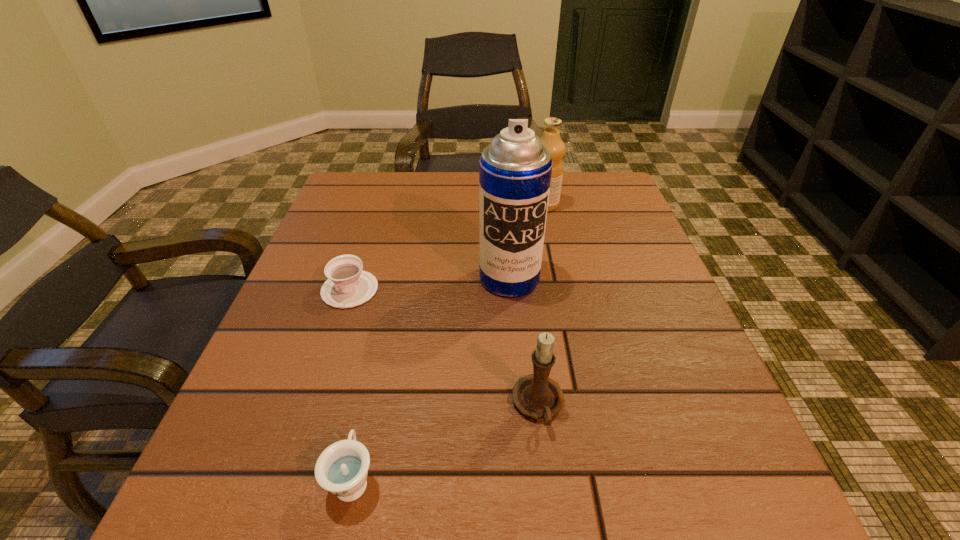
At what (x,y) coordinates should I click in order to perform the action: click on the tallest object. Please return your answer as a coordinate pair (x, y). This screenshot has height=540, width=960. Looking at the image, I should click on (515, 170).

The image size is (960, 540). Identify the location of the second tallest object. (551, 139).

Find the location of `olive oil`. olive oil is located at coordinates (551, 139).

You are a GUI agent. You are given a task and a screenshot of the screen. Output one action in this format:
    pyautogui.click(x=<x>, y=<y>)
    Task: Click on the third tallest object
    
    Given the screenshot: What is the action you would take?
    coord(536,395)

Where is `the second nearest object`? the second nearest object is located at coordinates (536, 395).

At what (x,y) coordinates should I click in order to perform the action: click on the nearest object. Please return your answer as a coordinate pair (x, y). This screenshot has height=540, width=960. Looking at the image, I should click on (342, 468).

At what (x,y) coordinates should I click in order to perform the action: click on the farther teacup. Please return your answer as a coordinate pair (x, y). The height and width of the screenshot is (540, 960). Looking at the image, I should click on (348, 285).

Locate an element on the screen. The width and height of the screenshot is (960, 540). free space located on the label side of the tallest object is located at coordinates (524, 466).

Locate an element on the screen. free space located 0.240m on the label of the farthest object is located at coordinates (434, 205).

At what (x,y) coordinates should I click in order to perform the action: click on vacant area situated on the label of the farthest object. Please return your answer as a coordinate pair (x, y). Looking at the image, I should click on (426, 205).